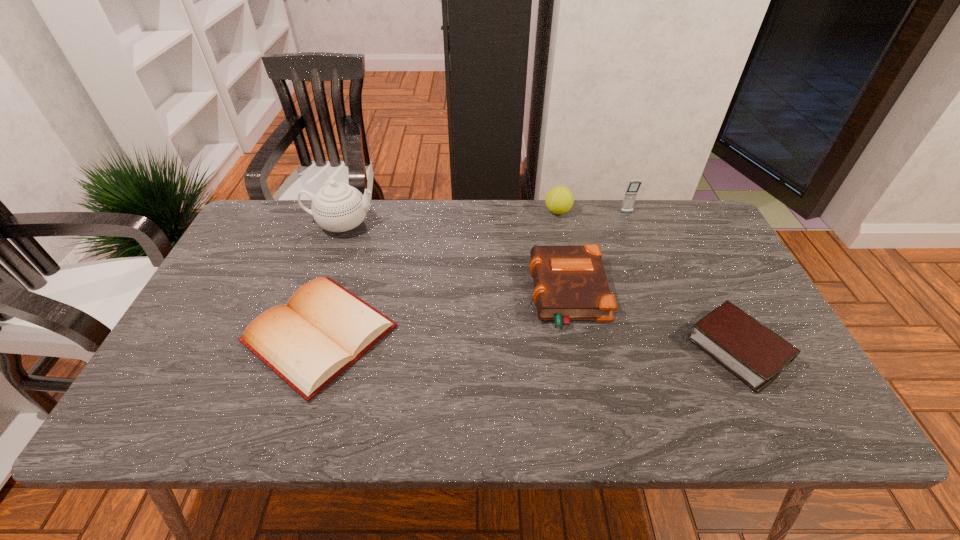
Find the location of a particular element. Bible that stands as the closest to the second Bible from right to left is located at coordinates (748, 349).

This screenshot has height=540, width=960. Identify the location of Bible that can be found as the second closest to the rightmost object. (324, 328).

You are a GUI agent. You are given a task and a screenshot of the screen. Output one action in this format:
    pyautogui.click(x=<x>, y=<y>)
    Task: Click on the vacant position in the image that satisfies the following two spatial constraints: 1. on the front-facing side of the fifth shortest object; 2. on the spout of the chinaware
    
    Given the screenshot: What is the action you would take?
    pyautogui.click(x=631, y=224)

Locate an element on the screen. free space in the image that satisfies the following two spatial constraints: 1. on the front side of the third tallest object; 2. on the spout of the chinaware is located at coordinates (561, 224).

Where is `vacant area in the image that satisfies the following two spatial constraints: 1. on the spout of the tallest object; 2. on the left side of the rightmost object`? This screenshot has height=540, width=960. vacant area in the image that satisfies the following two spatial constraints: 1. on the spout of the tallest object; 2. on the left side of the rightmost object is located at coordinates (297, 350).

Where is `free space that satisfies the following two spatial constraints: 1. on the spine side of the second Bible from left to right; 2. on the back side of the second shortest Bible`? The width and height of the screenshot is (960, 540). free space that satisfies the following two spatial constraints: 1. on the spine side of the second Bible from left to right; 2. on the back side of the second shortest Bible is located at coordinates (578, 350).